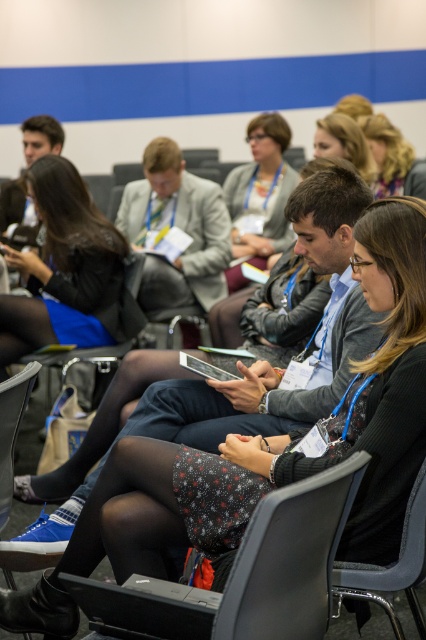
You are an event organizer who needs to ensure that all attendees can see the presentation screen located at the back of the room. Based on the scene, can the person sitting in the black fabric chair at lower right see the matte black hair at upper center without obstruction?

The black fabric chair at lower right is in front of matte black hair at upper center, so the person in the black fabric chair at lower right would be sitting in front of the matte black hair at upper center. This means the matte black hair at upper center might be partially blocked from view for someone behind them, but since the question is about seeing the matte black hair at upper center from the chair, the person in the chair would have an unobstructed view as they are in front. However, the answer may